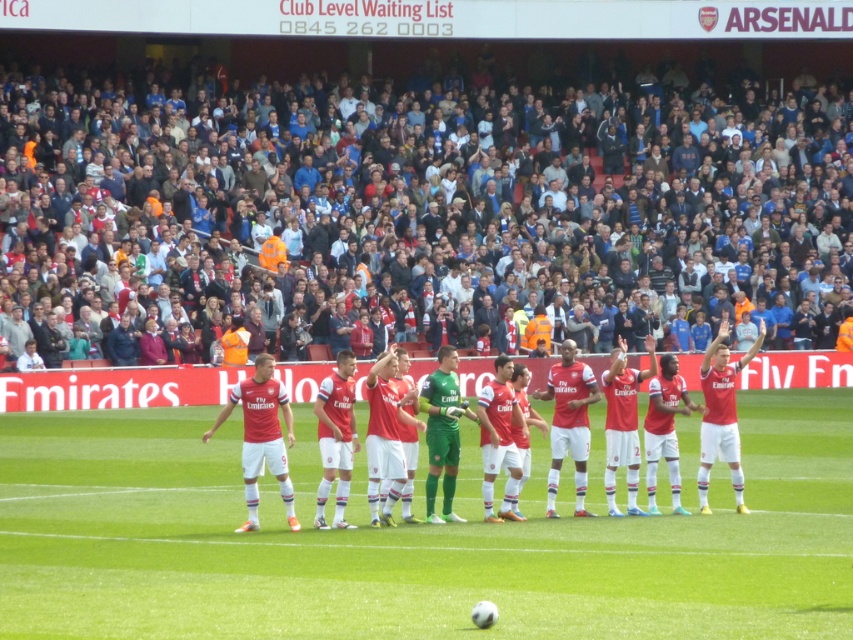
In the scene shown: You are a drone operator trying to capture a closeup of the Arsenal players during the tribute. The stadium has a restricted airspace zone at point [421,228]. You need to avoid this zone. Based on the scene description, where is the safest location to position your drone for the shot?

The safest location would be near the Arsenal players since the restricted airspace zone is at the multicolored fabric crowd at upper center located at point [421,228], which is in the background where the crowd is.

Consider the image. You are standing at the Emirates Stadium and want to throw a ball to a friend located at point (584, 148). If your throwing range is 45 meters, can you reach them?

The distance of point (584, 148) from viewer is 48.06 meters, so you cannot reach them as it exceeds your throwing range of 45 meters.

You are a photographer positioned at the Emirates Stadium during a match. You want to capture a photo where the green grass football field at center is in focus while the red matte jersey at center appears slightly blurred in the background. Is this possible given their positions?

Yes, because the green grass football field at center is closer to the viewer than the red matte jersey at center, so focusing on the field would naturally blur the jersey in the background.